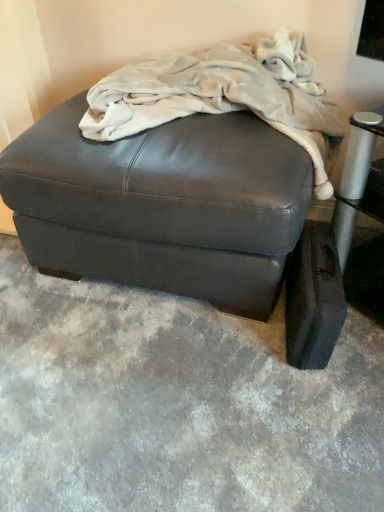
The width and height of the screenshot is (384, 512). In order to click on fuzzy white blanket at upper center in this screenshot , I will do `click(222, 95)`.

Which object is more forward, matte black ottoman at center or leather ottoman at lower right?

matte black ottoman at center is closer to the camera.

How many degrees apart are the facing directions of matte black ottoman at center and leather ottoman at lower right?

The angular difference between matte black ottoman at center and leather ottoman at lower right is 7.05 degrees.

From a real-world perspective, is matte black ottoman at center beneath leather ottoman at lower right?

No, from a real-world perspective, matte black ottoman at center is not below leather ottoman at lower right.

Between matte black ottoman at center and leather ottoman at lower right, which one has larger width?

matte black ottoman at center is wider.

Could you tell me if leather ottoman at lower right is facing fuzzy white blanket at upper center?

No, leather ottoman at lower right does not turn towards fuzzy white blanket at upper center.

Consider the image. Would you say leather ottoman at lower right is inside or outside fuzzy white blanket at upper center?

leather ottoman at lower right is spatially situated outside fuzzy white blanket at upper center.

Where is `blanket on the left side of leather ottoman at lower right`? The image size is (384, 512). blanket on the left side of leather ottoman at lower right is located at coordinates (222, 95).

In the image, is leather ottoman at lower right positioned in front of or behind fuzzy white blanket at upper center?

leather ottoman at lower right is behind fuzzy white blanket at upper center.

Can we say leather ottoman at lower right lies outside matte black ottoman at center?

Yes, leather ottoman at lower right is not within matte black ottoman at center.

Does point (293, 328) come closer to viewer compared to point (106, 158)?

That is False.

Which of these two, leather ottoman at lower right or matte black ottoman at center, is thinner?

leather ottoman at lower right is thinner.

Considering the sizes of objects fuzzy white blanket at upper center and leather ottoman at lower right in the image provided, who is taller, fuzzy white blanket at upper center or leather ottoman at lower right?

fuzzy white blanket at upper center is taller.

Is fuzzy white blanket at upper center positioned beyond the bounds of leather ottoman at lower right?

Yes, fuzzy white blanket at upper center is not within leather ottoman at lower right.

Is fuzzy white blanket at upper center at the left side of leather ottoman at lower right?

Correct, you'll find fuzzy white blanket at upper center to the left of leather ottoman at lower right.

Does point (244, 209) come in front of point (171, 92)?

Yes, it is in front of point (171, 92).

Is matte black ottoman at center bigger than fuzzy white blanket at upper center?

Indeed, matte black ottoman at center has a larger size compared to fuzzy white blanket at upper center.

From the image's perspective, is matte black ottoman at center on top of fuzzy white blanket at upper center?

No.

Which of these two, fuzzy white blanket at upper center or matte black ottoman at center, is bigger?

With larger size is matte black ottoman at center.

Does fuzzy white blanket at upper center have a greater height compared to matte black ottoman at center?

No, fuzzy white blanket at upper center is not taller than matte black ottoman at center.

Which object is further away from the camera, fuzzy white blanket at upper center or matte black ottoman at center?

matte black ottoman at center is further from the camera.

Is fuzzy white blanket at upper center not within matte black ottoman at center?

No, fuzzy white blanket at upper center is inside or overlapping with matte black ottoman at center.

Locate an element on the screen. The width and height of the screenshot is (384, 512). furniture in front of the leather ottoman at lower right is located at coordinates pyautogui.click(x=162, y=205).

At what (x,y) coordinates should I click in order to perform the action: click on pad on the right of fuzzy white blanket at upper center. Please return your answer as a coordinate pair (x, y). Looking at the image, I should click on (314, 298).

Estimate the real-world distances between objects in this image. Which object is further from leather ottoman at lower right, matte black ottoman at center or fuzzy white blanket at upper center?

fuzzy white blanket at upper center lies further to leather ottoman at lower right than the other object.

Estimate the real-world distances between objects in this image. Which object is further from matte black ottoman at center, fuzzy white blanket at upper center or leather ottoman at lower right?

The object further to matte black ottoman at center is leather ottoman at lower right.

In the scene shown: From the image, which object appears to be farther from fuzzy white blanket at upper center, matte black ottoman at center or leather ottoman at lower right?

The object further to fuzzy white blanket at upper center is leather ottoman at lower right.

Looking at the image, which one is located further to fuzzy white blanket at upper center, leather ottoman at lower right or matte black ottoman at center?

Based on the image, leather ottoman at lower right appears to be further to fuzzy white blanket at upper center.

Which object lies further to the anchor point matte black ottoman at center, leather ottoman at lower right or fuzzy white blanket at upper center?

leather ottoman at lower right is further to matte black ottoman at center.

Based on their spatial positions, is fuzzy white blanket at upper center or matte black ottoman at center closer to leather ottoman at lower right?

Based on the image, matte black ottoman at center appears to be nearer to leather ottoman at lower right.

Find the location of a particular element. furniture between fuzzy white blanket at upper center and leather ottoman at lower right from top to bottom is located at coordinates (162, 205).